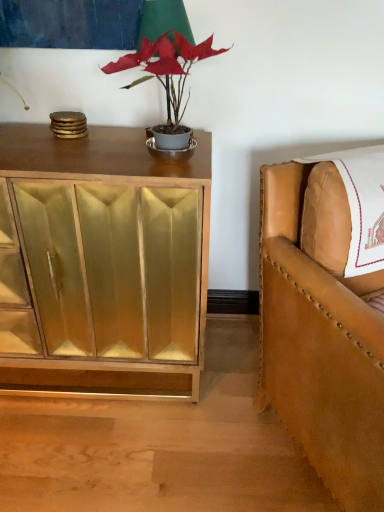
Question: Is matte gray pot at center surrounded by tan leather chair at right?

Choices:
 (A) no
 (B) yes

Answer: (A)

Question: From a real-world perspective, is tan leather chair at right physically below matte gray pot at center?

Choices:
 (A) yes
 (B) no

Answer: (A)

Question: Is tan leather chair at right wider than matte gray pot at center?

Choices:
 (A) no
 (B) yes

Answer: (B)

Question: Does tan leather chair at right lie in front of matte gray pot at center?

Choices:
 (A) no
 (B) yes

Answer: (B)

Question: Is tan leather chair at right not close to matte gray pot at center?

Choices:
 (A) no
 (B) yes

Answer: (A)

Question: Is tan leather chair at right aimed at matte gray pot at center?

Choices:
 (A) no
 (B) yes

Answer: (A)

Question: Is gold mirrored cabinet at left far away from tan leather chair at right?

Choices:
 (A) no
 (B) yes

Answer: (A)

Question: Does gold mirrored cabinet at left come in front of tan leather chair at right?

Choices:
 (A) no
 (B) yes

Answer: (A)

Question: From the image's perspective, is gold mirrored cabinet at left below tan leather chair at right?

Choices:
 (A) no
 (B) yes

Answer: (A)

Question: Can you confirm if gold mirrored cabinet at left is thinner than tan leather chair at right?

Choices:
 (A) yes
 (B) no

Answer: (A)

Question: Is gold mirrored cabinet at left not within tan leather chair at right?

Choices:
 (A) yes
 (B) no

Answer: (A)

Question: Is gold mirrored cabinet at left with tan leather chair at right?

Choices:
 (A) yes
 (B) no

Answer: (B)

Question: From the image's perspective, is matte gray pot at center beneath green fabric table lamp at upper center?

Choices:
 (A) no
 (B) yes

Answer: (B)